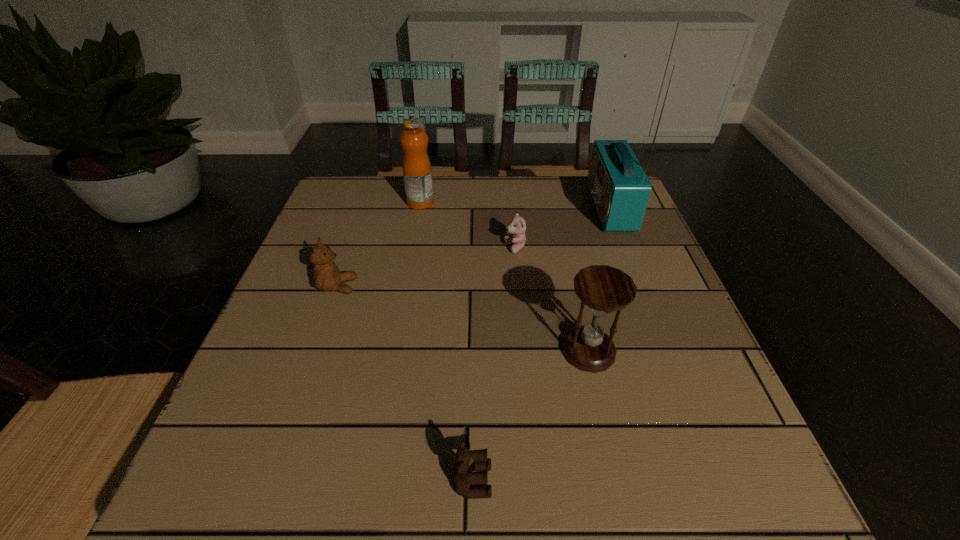
Locate an element on the screen. The height and width of the screenshot is (540, 960). radio receiver is located at coordinates (620, 189).

Identify the location of the tallest object. This screenshot has width=960, height=540. (620, 189).

Where is `fruit juice`? Image resolution: width=960 pixels, height=540 pixels. fruit juice is located at coordinates tap(416, 165).

The width and height of the screenshot is (960, 540). In order to click on the second tallest object in this screenshot , I will do `click(416, 165)`.

Locate an element on the screen. The width and height of the screenshot is (960, 540). the second object from right to left is located at coordinates tap(604, 289).

I want to click on the second nearest object, so click(604, 289).

The height and width of the screenshot is (540, 960). In order to click on the leftmost teddy bear in this screenshot , I will do `click(327, 277)`.

This screenshot has height=540, width=960. Find the location of `the tallest teddy bear`. the tallest teddy bear is located at coordinates (327, 277).

The image size is (960, 540). What are the coordinates of `the rightmost teddy bear` in the screenshot? It's located at (517, 227).

Find the location of `the third object from right to left`. the third object from right to left is located at coordinates (517, 227).